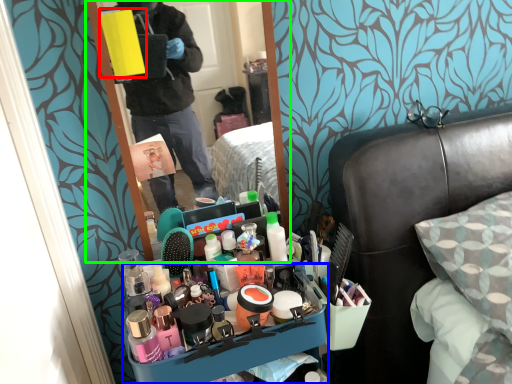
Question: Based on their relative distances, which object is nearer to box (highlighted by a red box)? Choose from desk (highlighted by a blue box) and mirror (highlighted by a green box).

Choices:
 (A) desk
 (B) mirror

Answer: (A)